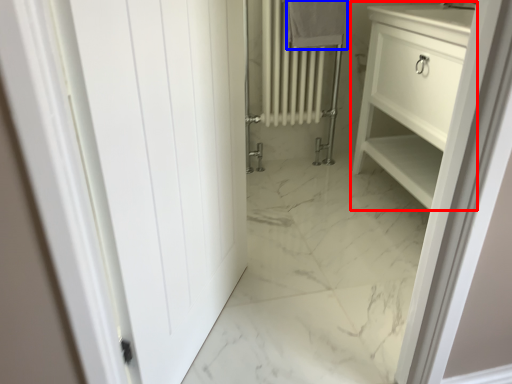
Question: Which object appears closest to the camera in this image, bathroom cabinet (highlighted by a red box) or bath towel (highlighted by a blue box)?

Choices:
 (A) bathroom cabinet
 (B) bath towel

Answer: (A)